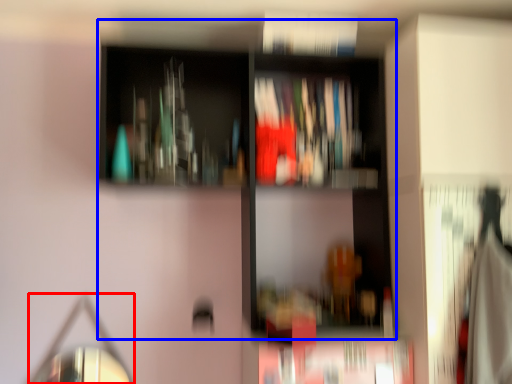
Question: Which of the following is the farthest to the observer, mirror (highlighted by a red box) or bookcase (highlighted by a blue box)?

Choices:
 (A) mirror
 (B) bookcase

Answer: (A)